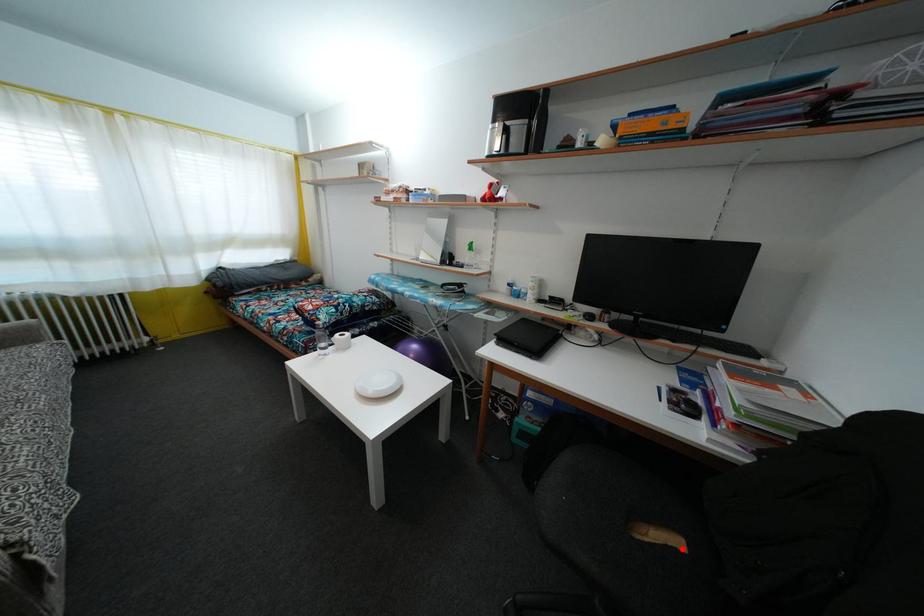
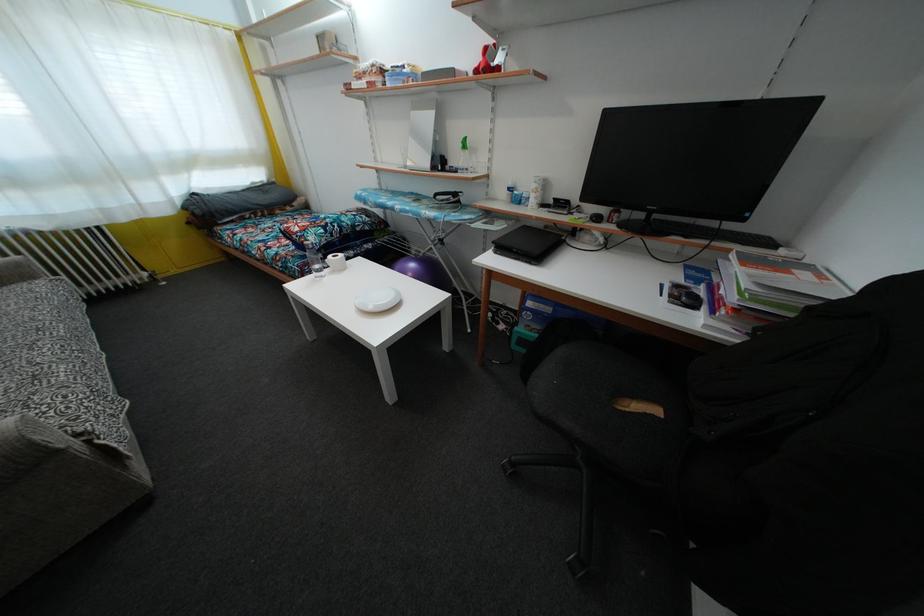
In the second image, find the point that corresponds to the highlighted location in the first image.

(660, 418)